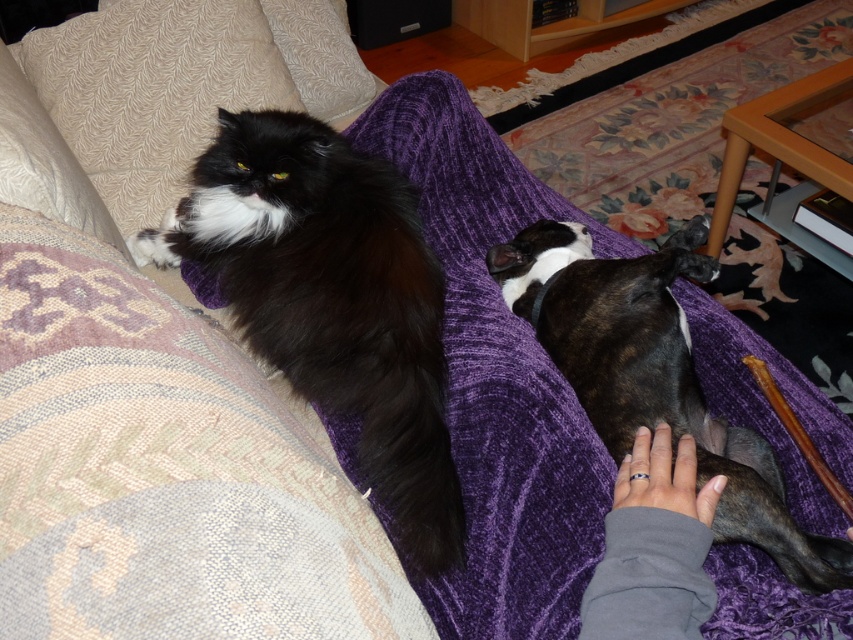
Can you confirm if black fluffy cat at upper left is taller than brindle fur dog at lower right?

Yes, black fluffy cat at upper left is taller than brindle fur dog at lower right.

Based on the photo, can you confirm if black fluffy cat at upper left is wider than brindle fur dog at lower right?

Yes.

Is point (262, 266) farther from viewer compared to point (758, 436)?

That is True.

Locate an element on the screen. The image size is (853, 640). black fluffy cat at upper left is located at coordinates (331, 300).

Looking at this image, is black fluffy cat at upper left positioned in front of beige textured pillow at upper left?

That is True.

Based on the photo, which is above, black fluffy cat at upper left or beige textured pillow at upper left?

beige textured pillow at upper left

Locate an element on the screen. Image resolution: width=853 pixels, height=640 pixels. black fluffy cat at upper left is located at coordinates (331, 300).

Who is positioned more to the right, purple velvet blanket at center or black fluffy cat at upper left?

Positioned to the right is purple velvet blanket at center.

Where is `purple velvet blanket at center`? This screenshot has width=853, height=640. purple velvet blanket at center is located at coordinates (498, 376).

The width and height of the screenshot is (853, 640). In order to click on purple velvet blanket at center in this screenshot , I will do `click(498, 376)`.